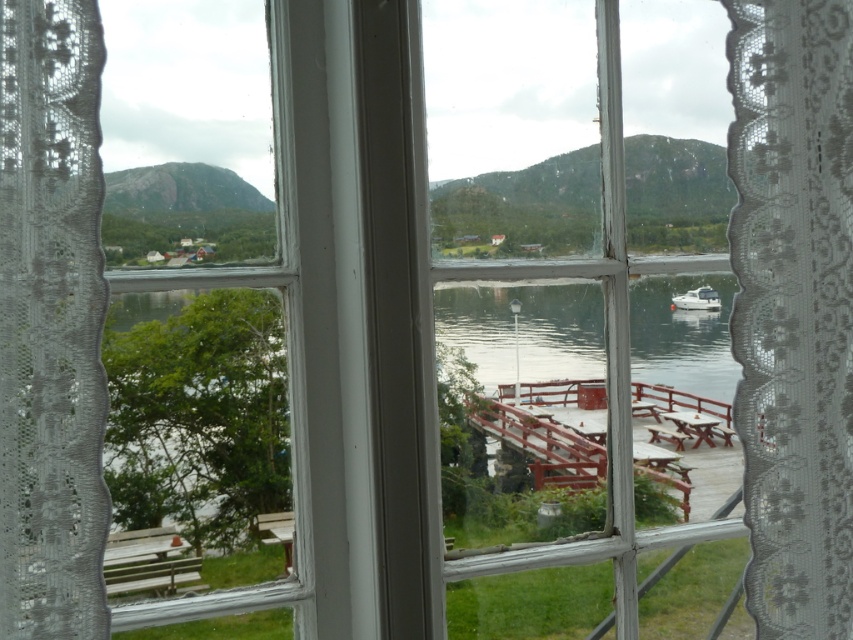
Can you confirm if white lace curtain at left is positioned below white glossy boat at center-right?

Yes.

Which is in front, point (21, 440) or point (677, 308)?

Point (21, 440)

You are a GUI agent. You are given a task and a screenshot of the screen. Output one action in this format:
    pyautogui.click(x=<x>, y=<y>)
    Task: Click on the white lace curtain at left
    The height and width of the screenshot is (640, 853).
    Given the screenshot: What is the action you would take?
    pyautogui.click(x=51, y=321)

Is white lace curtain at center positioned in front of white glossy boat at center-right?

Yes, it is.

Who is more forward, (838,58) or (672,305)?

Point (838,58) is more forward.

Is point (776, 280) positioned in front of point (714, 291)?

Yes, point (776, 280) is in front of point (714, 291).

This screenshot has height=640, width=853. Identify the location of white lace curtain at center. (793, 307).

Which of these two, white lace curtain at center or white lace curtain at left, stands taller?

white lace curtain at center is taller.

Describe the element at coordinates (793, 307) in the screenshot. This screenshot has width=853, height=640. I see `white lace curtain at center` at that location.

At what (x,y) coordinates should I click in order to perform the action: click on white lace curtain at center. Please return your answer as a coordinate pair (x, y). This screenshot has width=853, height=640. Looking at the image, I should click on (793, 307).